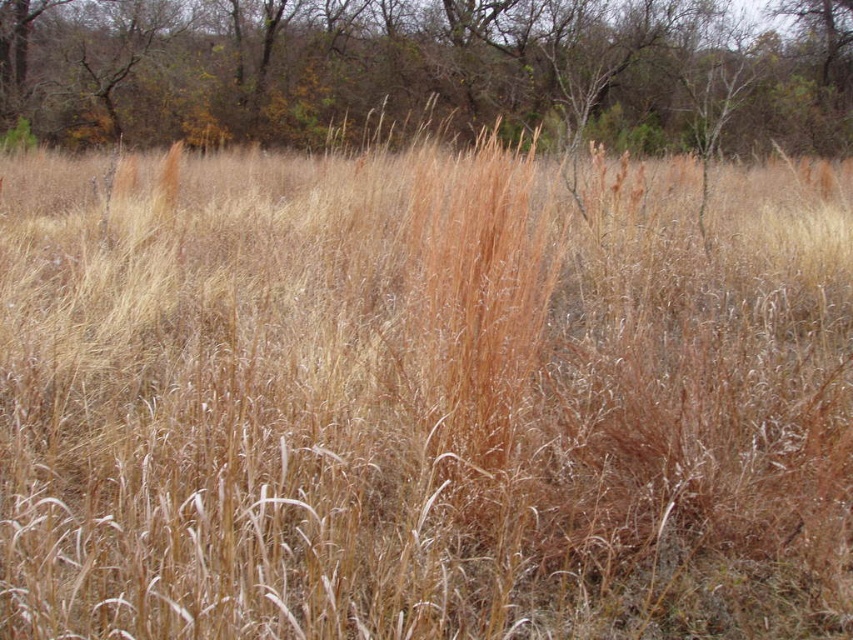
You are standing in the field and see the brown textured grass at upper center and the brown grass at center. Which one is higher in elevation?

The brown textured grass at upper center is higher in elevation than the brown grass at center.

You are a hiker who wants to cross the field of grass. You notice two patches of grass in the image. Which one is more to the left, the brown textured grass at upper center or the brown grass at center?

The brown textured grass at upper center is more to the left than the brown grass at center.

You are standing in the field of grass and want to walk towards the brown grass at center. Which direction should you move relative to the brown textured grass at upper center?

You should move away from the brown textured grass at upper center because it is closer to you than the brown grass at center, which is further away.